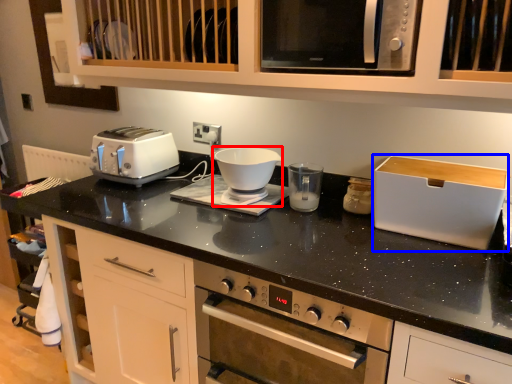
Question: Which of the following is the closest to the observer, food processor (highlighted by a red box) or appliance (highlighted by a blue box)?

Choices:
 (A) food processor
 (B) appliance

Answer: (B)